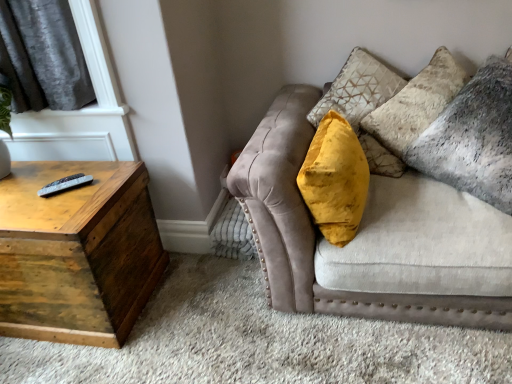
This screenshot has width=512, height=384. What do you see at coordinates (335, 179) in the screenshot? I see `velvet yellow pillow at center` at bounding box center [335, 179].

Describe the element at coordinates (65, 184) in the screenshot. I see `black plastic remote at left` at that location.

This screenshot has height=384, width=512. Find the location of `black plastic remote at left`. black plastic remote at left is located at coordinates tap(65, 184).

Locate an element on the screen. The width and height of the screenshot is (512, 384). velvet beige couch at upper right is located at coordinates (371, 237).

What is the approximate width of velvet beige couch at upper right?

1.08 meters.

In order to face velvet gray pillow at upper right, should I rotate leftwards or rightwards?

A 28.581 degree turn to the right will do.

Identify the location of wooden trunk at left. Image resolution: width=512 pixels, height=384 pixels. (77, 253).

Find the location of a particular element. This screenshot has width=512, height=384. velvet yellow pillow at center is located at coordinates (335, 179).

Considering the relative sizes of velvet gray pillow at upper right and black plastic remote at left in the image provided, is velvet gray pillow at upper right thinner than black plastic remote at left?

No.

Is velvet gray pillow at upper right with black plastic remote at left?

No, velvet gray pillow at upper right is not in contact with black plastic remote at left.

Locate an element on the screen. pillow on the right of the black plastic remote at left is located at coordinates (473, 138).

Can you confirm if velvet gray pillow at upper right is smaller than black plastic remote at left?

Actually, velvet gray pillow at upper right might be larger than black plastic remote at left.

Where is `throw pillow that is on the right side of wooden trunk at left`? Image resolution: width=512 pixels, height=384 pixels. throw pillow that is on the right side of wooden trunk at left is located at coordinates (335, 179).

Is velvet yellow pillow at center at the right side of wooden trunk at left?

Yes, velvet yellow pillow at center is to the right of wooden trunk at left.

Is velvet yellow pillow at center next to wooden trunk at left and touching it?

They are not placed beside each other.

Is velvet yellow pillow at center positioned before wooden trunk at left?

Yes, velvet yellow pillow at center is closer to the viewer.

In the scene shown: In terms of width, does black plastic remote at left look wider or thinner when compared to velvet gray pillow at upper right?

black plastic remote at left is thinner than velvet gray pillow at upper right.

Who is more distant, black plastic remote at left or velvet gray pillow at upper right?

black plastic remote at left is further from the camera.

Is black plastic remote at left completely or partially outside of velvet gray pillow at upper right?

Yes, black plastic remote at left is outside of velvet gray pillow at upper right.

Could you tell me if black plastic remote at left is turned towards velvet gray pillow at upper right?

A: No, black plastic remote at left is not facing towards velvet gray pillow at upper right.

Measure the distance between black plastic remote at left and velvet yellow pillow at center.

black plastic remote at left and velvet yellow pillow at center are 3.39 feet apart.

You are a GUI agent. You are given a task and a screenshot of the screen. Output one action in this format:
    pyautogui.click(x=<x>, y=<y>)
    Task: Click on the throw pillow below the black plastic remote at left (from a real-world perspective)
    The width and height of the screenshot is (512, 384).
    Given the screenshot: What is the action you would take?
    pyautogui.click(x=335, y=179)

Which of these two, black plastic remote at left or velvet yellow pillow at center, is wider?

velvet yellow pillow at center is wider.

Which point is more forward, (40, 191) or (352, 231)?

The point (352, 231) is in front.

Is velvet beige couch at upper right completely or partially inside velvet yellow pillow at center?

No, velvet beige couch at upper right is located outside of velvet yellow pillow at center.

Is the position of velvet yellow pillow at center less distant than that of velvet beige couch at upper right?

That is False.

Which of these two, velvet yellow pillow at center or velvet beige couch at upper right, stands shorter?

With less height is velvet yellow pillow at center.

Which point is more forward, (x=345, y=119) or (x=407, y=249)?

The point (x=407, y=249) is more forward.

Is black plastic remote at left facing away from wooden trunk at left?

No, black plastic remote at left is not facing away from wooden trunk at left.

Considering the relative positions of black plastic remote at left and wooden trunk at left in the image provided, is black plastic remote at left to the left or to the right of wooden trunk at left?

Clearly, black plastic remote at left is on the right of wooden trunk at left in the image.

Does point (84, 178) come in front of point (37, 197)?

No, it is behind (37, 197).

Is black plastic remote at left outside of wooden trunk at left?

black plastic remote at left is positioned outside wooden trunk at left.

Which is farther, (426, 248) or (347, 221)?

Point (347, 221)

This screenshot has height=384, width=512. In order to click on throw pillow behind the velvet beige couch at upper right in this screenshot , I will do `click(335, 179)`.

From a real-world perspective, does velvet beige couch at upper right stand above velvet yellow pillow at center?

No, from a real-world perspective, velvet beige couch at upper right is not on top of velvet yellow pillow at center.

Which object is wider, velvet beige couch at upper right or velvet yellow pillow at center?

velvet beige couch at upper right is wider.

At what (x,y) coordinates should I click in order to perform the action: click on remote that appears below the velvet gray pillow at upper right (from a real-world perspective). Please return your answer as a coordinate pair (x, y). Image resolution: width=512 pixels, height=384 pixels. Looking at the image, I should click on (65, 184).

Where is `table on the left of velvet yellow pillow at center`? The image size is (512, 384). table on the left of velvet yellow pillow at center is located at coordinates (77, 253).

Based on their spatial positions, is wooden trunk at left or black plastic remote at left further from velvet beige couch at upper right?

Based on the image, black plastic remote at left appears to be further to velvet beige couch at upper right.

From the image, which object appears to be farther from wooden trunk at left, velvet beige couch at upper right or velvet gray pillow at upper right?

The object further to wooden trunk at left is velvet gray pillow at upper right.

Based on their spatial positions, is wooden trunk at left or velvet yellow pillow at center further from black plastic remote at left?

Based on the image, velvet yellow pillow at center appears to be further to black plastic remote at left.

Which object lies nearer to the anchor point velvet beige couch at upper right, wooden trunk at left or velvet gray pillow at upper right?

Among the two, velvet gray pillow at upper right is located nearer to velvet beige couch at upper right.

Which object lies nearer to the anchor point black plastic remote at left, velvet beige couch at upper right or wooden trunk at left?

Based on the image, wooden trunk at left appears to be nearer to black plastic remote at left.

Looking at the image, which one is located closer to velvet gray pillow at upper right, wooden trunk at left or velvet yellow pillow at center?

velvet yellow pillow at center is positioned closer to the anchor velvet gray pillow at upper right.

Based on their spatial positions, is velvet gray pillow at upper right or velvet yellow pillow at center further from velvet beige couch at upper right?

velvet gray pillow at upper right is further to velvet beige couch at upper right.

When comparing their distances from wooden trunk at left, does velvet beige couch at upper right or velvet yellow pillow at center seem closer?

velvet beige couch at upper right.

This screenshot has width=512, height=384. I want to click on throw pillow located between wooden trunk at left and velvet gray pillow at upper right in the left-right direction, so click(x=335, y=179).

You are a GUI agent. You are given a task and a screenshot of the screen. Output one action in this format:
    pyautogui.click(x=<x>, y=<y>)
    Task: Click on the studio couch between black plastic remote at left and velvet gray pillow at upper right in the horizontal direction
    The height and width of the screenshot is (384, 512).
    Given the screenshot: What is the action you would take?
    pyautogui.click(x=371, y=237)

Identify the location of studio couch between wooden trunk at left and velvet gray pillow at upper right in the horizontal direction. This screenshot has width=512, height=384. (371, 237).

Identify the location of remote between wooden trunk at left and velvet beige couch at upper right. The width and height of the screenshot is (512, 384). (65, 184).